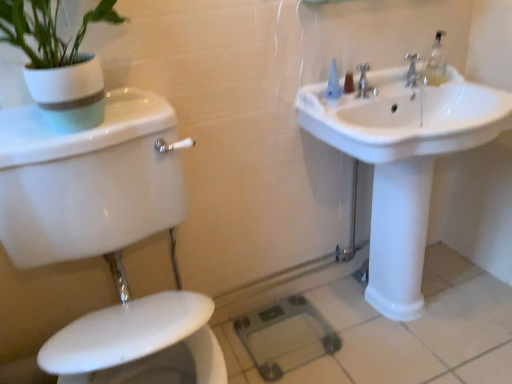
Question: Are white glossy sink at upper right and metallic silver faucet at upper right, the second tap in the left-to-right sequence, making contact?

Choices:
 (A) yes
 (B) no

Answer: (B)

Question: Does white glossy sink at upper right have a lesser height compared to metallic silver faucet at upper right, the second tap in the left-to-right sequence?

Choices:
 (A) yes
 (B) no

Answer: (B)

Question: From a real-world perspective, is white glossy sink at upper right positioned over metallic silver faucet at upper right, which is counted as the 1th tap, starting from the right, based on gravity?

Choices:
 (A) yes
 (B) no

Answer: (B)

Question: Is white glossy sink at upper right positioned in front of metallic silver faucet at upper right, which is counted as the 1th tap, starting from the right?

Choices:
 (A) no
 (B) yes

Answer: (B)

Question: Can you confirm if white glossy sink at upper right is wider than metallic silver faucet at upper right, the second tap in the left-to-right sequence?

Choices:
 (A) yes
 (B) no

Answer: (A)

Question: Is white glossy sink at upper right facing away from metallic silver faucet at upper right, the second tap in the left-to-right sequence?

Choices:
 (A) yes
 (B) no

Answer: (B)

Question: From a real-world perspective, is white glossy toilet at lower left on white glossy sink at upper right?

Choices:
 (A) yes
 (B) no

Answer: (A)

Question: Is white glossy toilet at lower left oriented towards white glossy sink at upper right?

Choices:
 (A) yes
 (B) no

Answer: (B)

Question: Is white glossy toilet at lower left wider than white glossy sink at upper right?

Choices:
 (A) yes
 (B) no

Answer: (A)

Question: From the image's perspective, is white glossy toilet at lower left above white glossy sink at upper right?

Choices:
 (A) yes
 (B) no

Answer: (B)

Question: Is white glossy toilet at lower left surrounding white glossy sink at upper right?

Choices:
 (A) no
 (B) yes

Answer: (A)

Question: Is white glossy toilet at lower left at the right side of white glossy sink at upper right?

Choices:
 (A) no
 (B) yes

Answer: (A)

Question: From a real-world perspective, is white glossy toilet at lower left below metallic silver faucet at upper right, which is counted as the 1th tap, starting from the right?

Choices:
 (A) yes
 (B) no

Answer: (A)